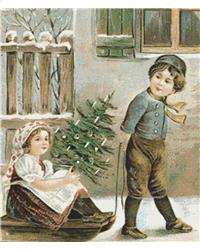
I want to click on painting, so click(160, 199), click(155, 124), click(45, 24), click(76, 197).